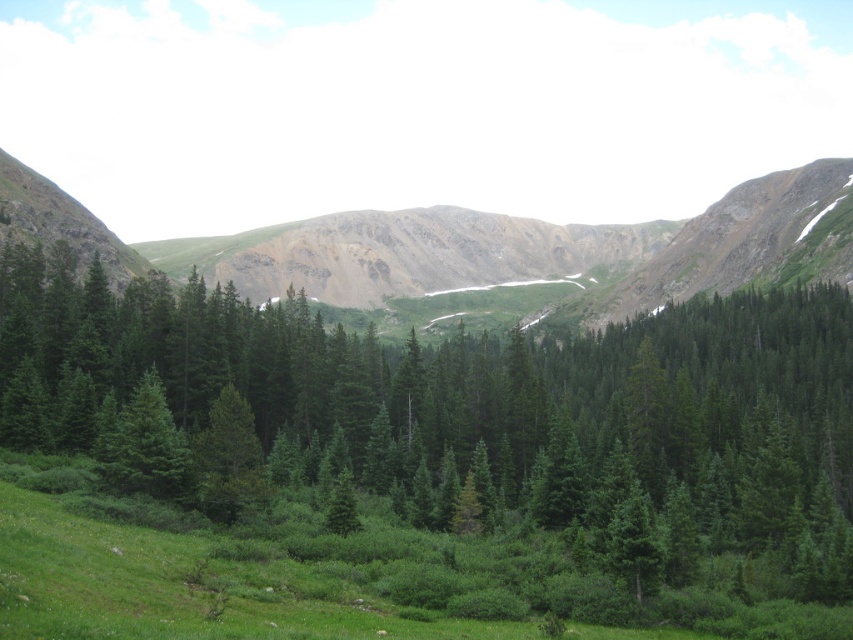
Question: Which of the following is the farthest from the observer?

Choices:
 (A) (148, 465)
 (B) (599, 250)

Answer: (B)

Question: Which point is closer to the camera taking this photo?

Choices:
 (A) (795, 528)
 (B) (135, 252)
 (C) (102, 458)

Answer: (A)

Question: Which point is farther from the camera taking this photo?

Choices:
 (A) (57, 200)
 (B) (166, 422)
 (C) (691, 394)

Answer: (A)

Question: Does green matte pine forest at center have a smaller size compared to green grassy mountain at center?

Choices:
 (A) no
 (B) yes

Answer: (B)

Question: Is green matte pine forest at center thinner than green grassy mountain at center?

Choices:
 (A) yes
 (B) no

Answer: (A)

Question: Is green grassy mountain at center further to camera compared to green matte tree at center-left?

Choices:
 (A) no
 (B) yes

Answer: (B)